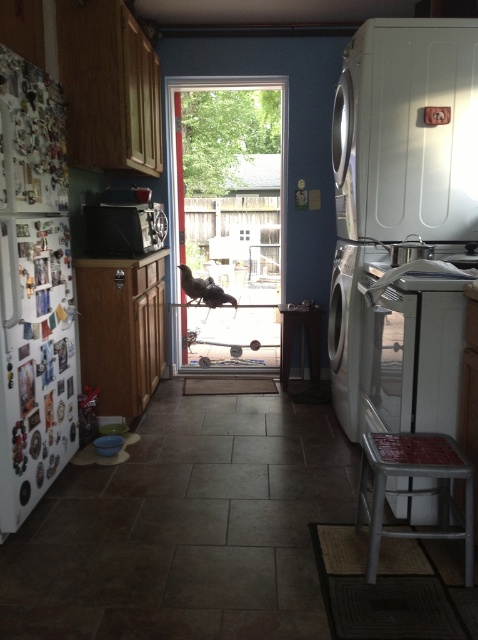
You are standing in the kitchen and want to reach a point that is 7.20 feet away from you. Can you confirm if the point you are aiming for is the point at coordinates point (32, 182)?

Yes, the point at coordinates point (32, 182) is exactly 7.20 feet away from the viewer, so it matches the distance you are aiming for.

You are standing in the kitchen and want to exit through the clear glass screen door at center. There is a metallic silver stool at lower right nearby. Which object is closer to you as you face the door?

The clear glass screen door at center is closer to you than the metallic silver stool at lower right because it is further to the viewer.

You are organizing a kitchen party and need to place a large platter on a metallic silver appliance. Which object between the metallic silver stool at lower right and the metallic silver microwave at center is more suitable for placing the platter?

The metallic silver microwave at center is more suitable for placing the large platter because it has a larger size compared to the metallic silver stool at lower right.